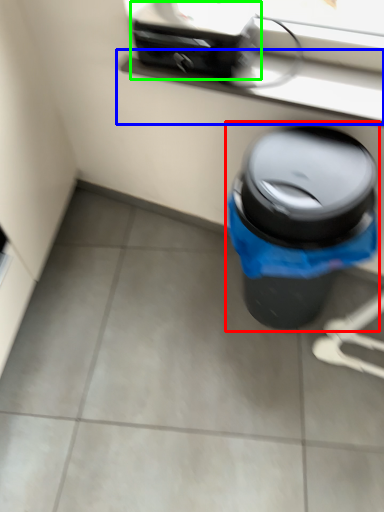
Question: Based on their relative distances, which object is farther from waste container (highlighted by a red box)? Choose from window sill (highlighted by a blue box) and appliance (highlighted by a green box).

Choices:
 (A) window sill
 (B) appliance

Answer: (B)